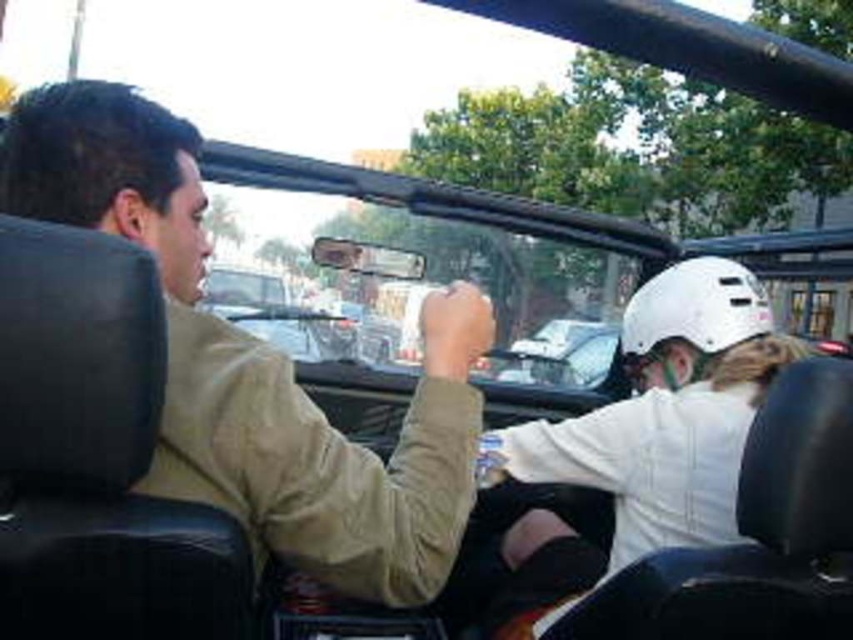
Question: Based on their relative distances, which object is nearer to the khaki cotton shirt at center?

Choices:
 (A) khakimaterial at left
 (B) white matte helmet at upper right

Answer: (A)

Question: Which is nearer to the khaki cotton shirt at center?

Choices:
 (A) white matte helmet at upper right
 (B) khakimaterial at left

Answer: (B)

Question: Among these points, which one is nearest to the camera?

Choices:
 (A) (440, 429)
 (B) (537, 428)
 (C) (196, 180)

Answer: (A)

Question: Can you confirm if khakimaterial at left is positioned to the right of white matte helmet at upper right?

Choices:
 (A) no
 (B) yes

Answer: (A)

Question: Does khakimaterial at left appear under white matte helmet at upper right?

Choices:
 (A) yes
 (B) no

Answer: (B)

Question: Can you confirm if khakimaterial at left is wider than white matte helmet at upper right?

Choices:
 (A) no
 (B) yes

Answer: (A)